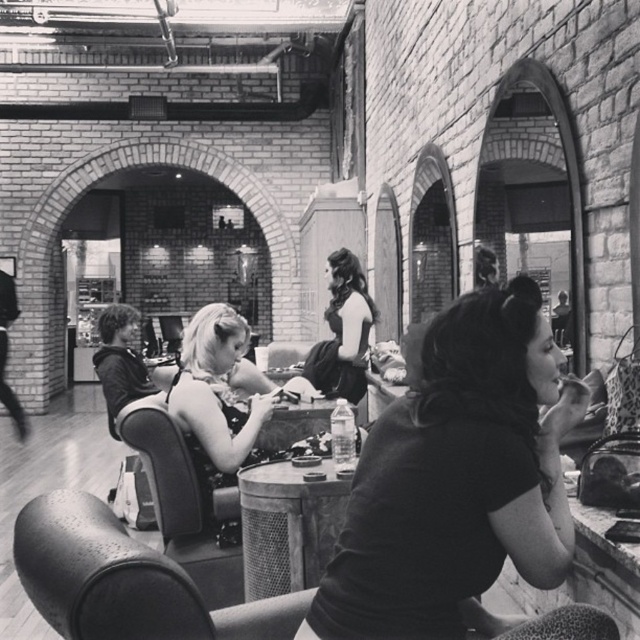
Between point (225, 461) and point (364, 333), which one is positioned behind?

The point (364, 333) is behind.

Based on the photo, who is more distant from viewer, (225,401) or (362,300)?

Positioned behind is point (362,300).

Locate an element on the screen. The width and height of the screenshot is (640, 640). matte black hair at center is located at coordinates (216, 397).

Is matte black hair at center taller than metal mesh table at center?

Correct, matte black hair at center is much taller as metal mesh table at center.

Which of these two, matte black hair at center or metal mesh table at center, stands taller?

With more height is matte black hair at center.

Who is more distant from viewer, (202, 390) or (284, 588)?

The point (202, 390) is behind.

This screenshot has width=640, height=640. I want to click on matte black hair at center, so click(x=216, y=397).

Between point (502, 484) and point (230, 458), which one is positioned behind?

Positioned behind is point (230, 458).

Is matte black shirt at center positioned before matte black hair at center?

That is True.

Is point (515, 444) behind point (186, 422)?

No, (515, 444) is closer to viewer.

Locate an element on the screen. matte black shirt at center is located at coordinates (458, 481).